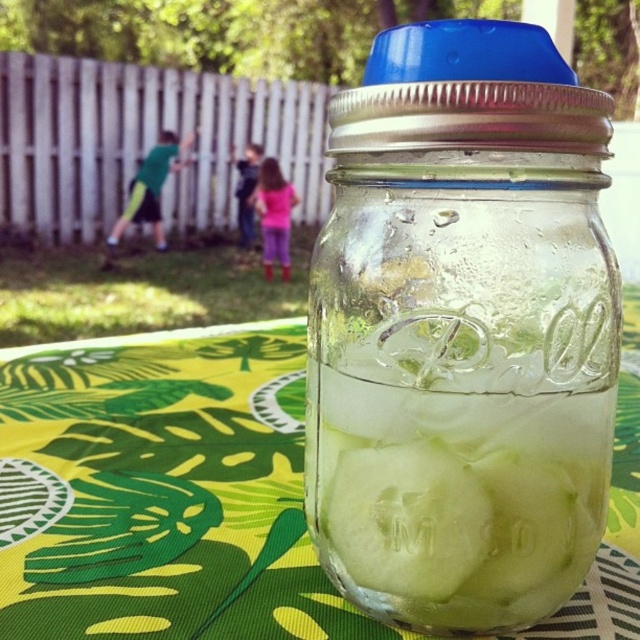
Is green fabric pants at left wider than pink fabric pants at center?

Yes.

Is green fabric pants at left shorter than pink fabric pants at center?

No.

Does point (164, 177) lie behind point (278, 259)?

No.

At what (x,y) coordinates should I click in order to perform the action: click on green fabric pants at left. Please return your answer as a coordinate pair (x, y). This screenshot has height=640, width=640. Looking at the image, I should click on (148, 192).

Does point (225, 410) come behind point (328, 486)?

That is True.

Does green fabric at center appear under clear glass ice at center?

Actually, green fabric at center is above clear glass ice at center.

Who is more distant from viewer, (260,362) or (348,552)?

The point (260,362) is behind.

Identify the location of green fabric at center. The height and width of the screenshot is (640, 640). (161, 490).

Does green translucent cucumber at center have a larger size compared to green matte cucumber at center?

Yes.

In the scene shown: Who is more forward, [376,522] or [502,596]?

Positioned in front is point [376,522].

This screenshot has height=640, width=640. Identify the location of green translucent cucumber at center. (406, 518).